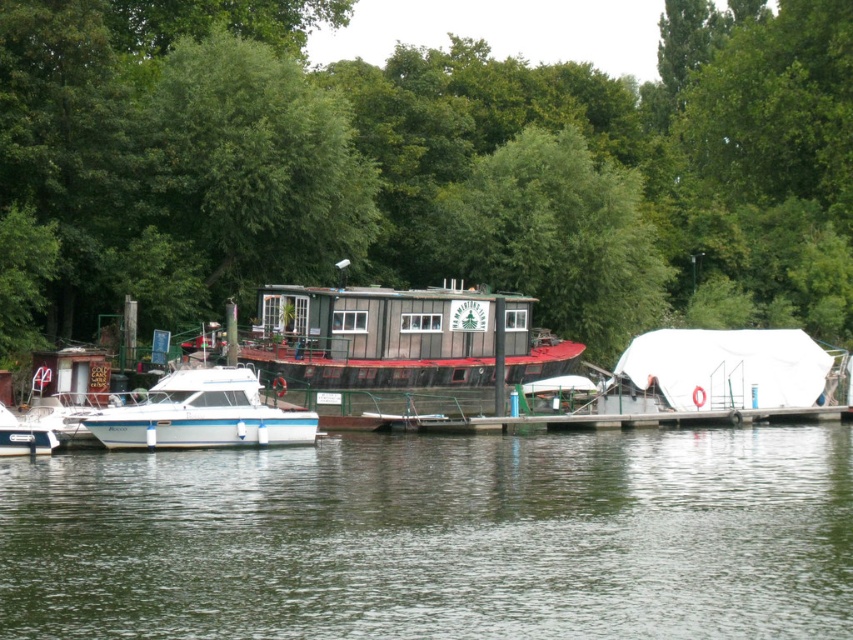
You are planning to take a photo of the white glossy boat at left and the green leafy tree at upper center. Which object is wider in the image?

The green leafy tree at upper center is wider than the white glossy boat at left.

You are standing on the deck of the houseboat and want to visit the green leafy tree at upper center. The white glossy boat at left is in between you and the tree. Can you walk directly to the tree without going around the boat?

The green leafy tree at upper center is 19.74 meters from the white glossy boat at left. Since the boat is between you and the tree, you would need to go around the boat to reach the tree.

You are a drone operator trying to capture a photo of the green leafy tree at upper center. The drone is currently positioned at point 0.25, 0.5. What direction should you move the drone to align it with the tree?

The green leafy tree at upper center is located at point (422, 168). Since the drone is at (426, 160), you should move it slightly to the right and down to align with the tree.